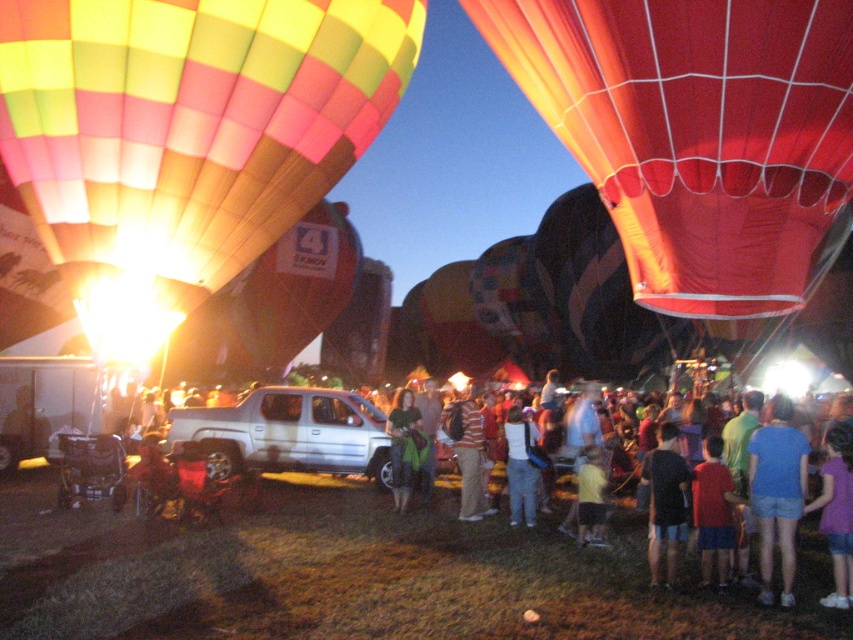
You are a photographer at the hot air balloon festival. You want to capture a photo that includes both the red fabric balloon at upper right and the multicolored fabric crowd at center. Which object should you position closer to the bottom of the frame to ensure both are fully visible?

The red fabric balloon at upper right is much taller than the multicolored fabric crowd at center. To ensure both are fully visible, position the multicolored fabric crowd at center closer to the bottom of the frame since it is shorter and the balloon is taller.